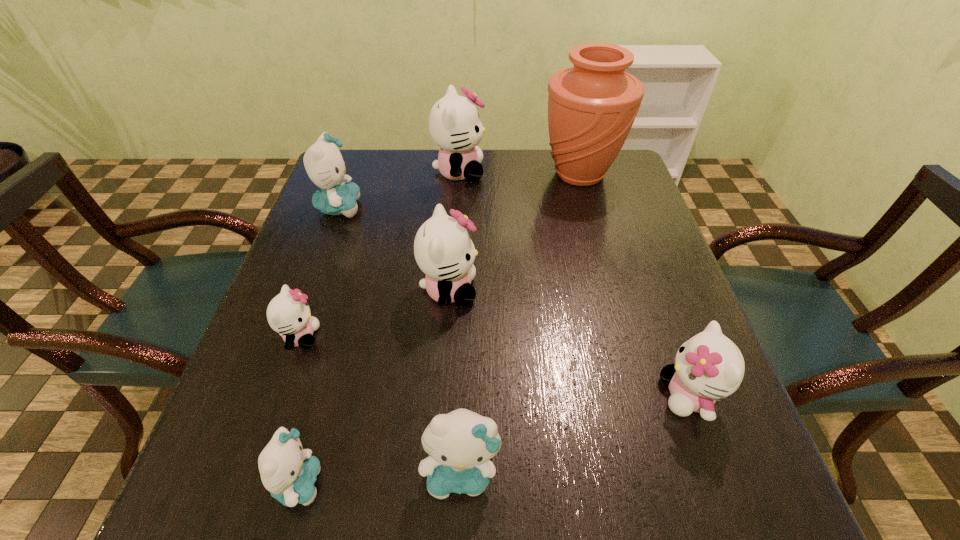
At what (x,y) coordinates should I click in order to perform the action: click on vacant region at the near right corner. Please return your answer as a coordinate pair (x, y). The image size is (960, 540). Looking at the image, I should click on (732, 472).

What are the coordinates of `free spot between the second biggest white kitten and the smallest blue kitten` in the screenshot? It's located at (374, 387).

This screenshot has height=540, width=960. I want to click on vacant area that lies between the tallest kitten and the smallest white kitten, so click(x=380, y=254).

The height and width of the screenshot is (540, 960). Identify the location of free spot between the second biggest blue kitten and the smallest blue kitten. (380, 477).

Locate an element on the screen. vacant space in between the farthest blue kitten and the smallest blue kitten is located at coordinates (319, 345).

Where is `free space between the leftmost white kitten and the second smallest white kitten`? This screenshot has height=540, width=960. free space between the leftmost white kitten and the second smallest white kitten is located at coordinates (494, 366).

The width and height of the screenshot is (960, 540). Find the location of `vacant area that lies between the rightmost white kitten and the biggest white kitten`. vacant area that lies between the rightmost white kitten and the biggest white kitten is located at coordinates (574, 284).

You are a GUI agent. You are given a task and a screenshot of the screen. Output one action in this format:
    pyautogui.click(x=<x>, y=<y>)
    Task: Click on the vacant area that lies between the vase and the biggest white kitten
    
    Given the screenshot: What is the action you would take?
    pyautogui.click(x=519, y=173)

The image size is (960, 540). Find the location of `free area in between the smallest blue kitten and the seventh shortest object`. free area in between the smallest blue kitten and the seventh shortest object is located at coordinates (379, 327).

The height and width of the screenshot is (540, 960). Identify the location of vacant area that lies between the smallest blue kitten and the vase. (440, 329).